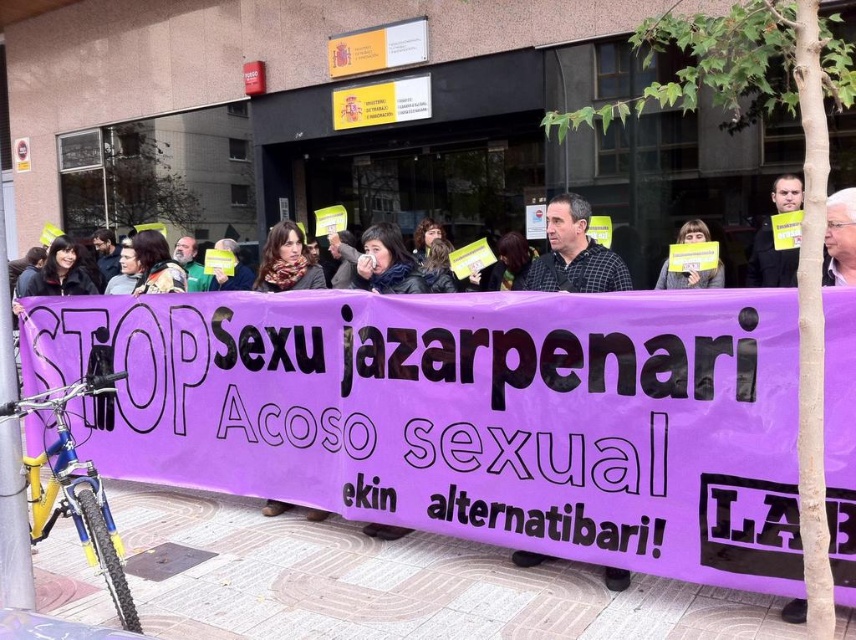
Is purple fabric at center positioned behind matte black shirt at center?

No.

Between purple fabric at center and matte black shirt at center, which one appears on the left side from the viewer's perspective?

purple fabric at center

The height and width of the screenshot is (640, 856). What are the coordinates of `purple fabric at center` in the screenshot? It's located at (385, 262).

In the scene shown: Who is higher up, purple fabric banner at center or checkered fabric shirt at center?

checkered fabric shirt at center is higher up.

Is purple fabric banner at center above checkered fabric shirt at center?

Incorrect, purple fabric banner at center is not positioned above checkered fabric shirt at center.

Is point (33, 362) less distant than point (578, 216)?

No, it is not.

I want to click on purple fabric banner at center, so click(x=462, y=413).

Is checkered fabric shirt at center to the right of purple fabric at center from the viewer's perspective?

Yes, checkered fabric shirt at center is to the right of purple fabric at center.

Which of these two, checkered fabric shirt at center or purple fabric at center, stands shorter?

Standing shorter between the two is purple fabric at center.

Is point (516, 557) more distant than point (361, 282)?

No, (516, 557) is in front of (361, 282).

At what (x,y) coordinates should I click in order to perform the action: click on checkered fabric shirt at center. Please return your answer as a coordinate pair (x, y). This screenshot has width=856, height=640. Looking at the image, I should click on tap(574, 253).